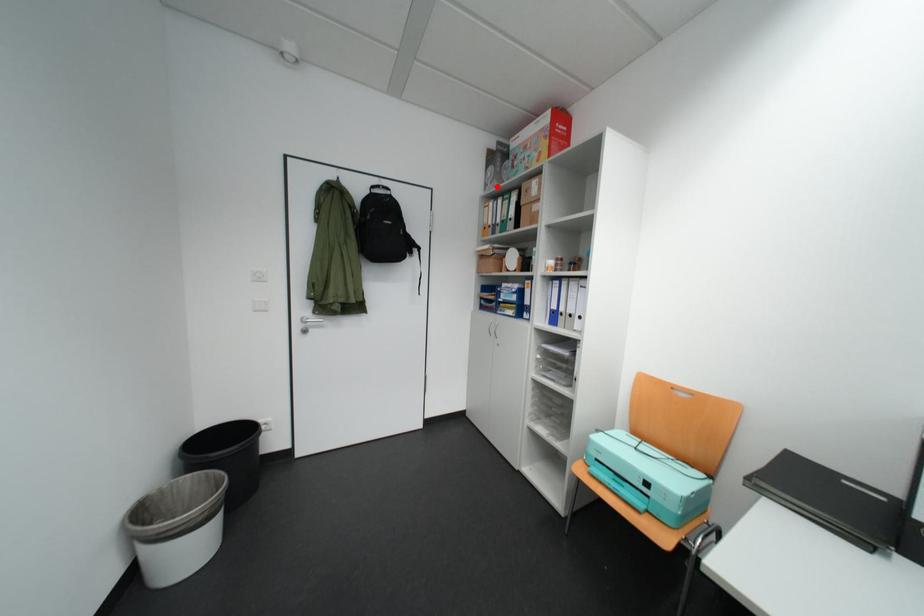
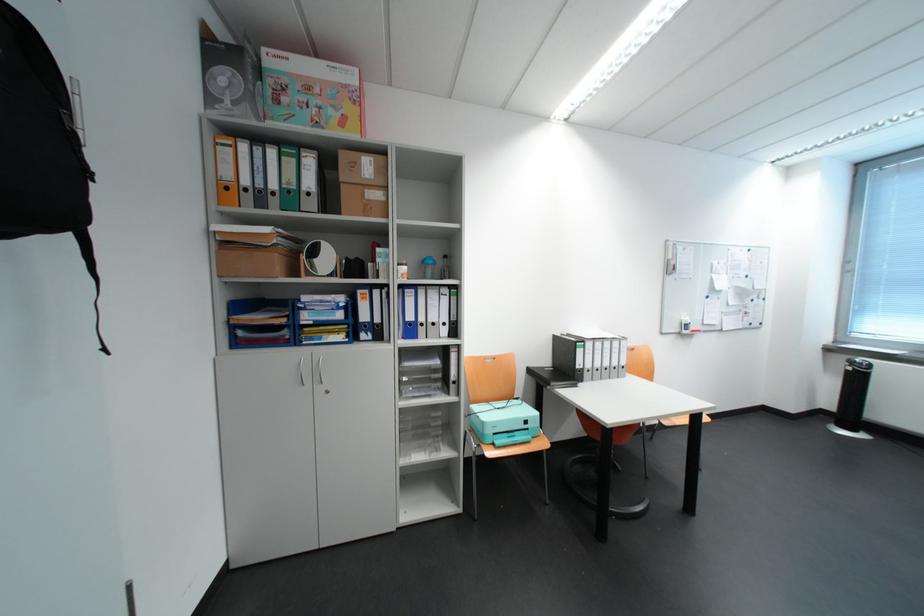
Find the pixel in the second image that matches the highlighted location in the first image.

(223, 99)